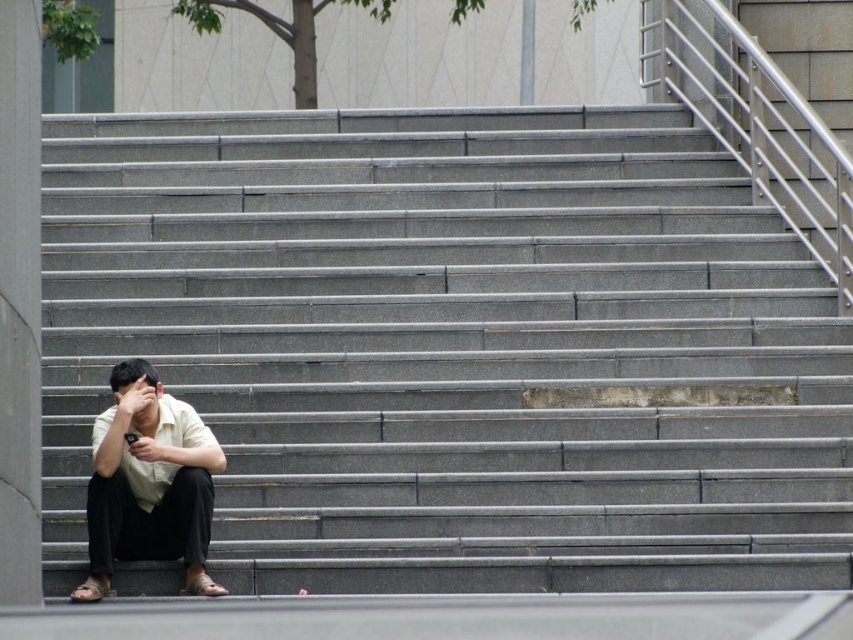
Which of these two, white matte shirt at lower left or white matte hand at lower left, stands taller?

white matte shirt at lower left is taller.

Does white matte shirt at lower left have a greater width compared to white matte hand at lower left?

Yes, white matte shirt at lower left is wider than white matte hand at lower left.

Who is more forward, (106, 589) or (157, 460)?

Point (106, 589)

Identify the location of white matte shirt at lower left. This screenshot has height=640, width=853. (149, 490).

Is gray concrete stairs at lower left positioned in front of matte black hand at lower left?

Yes, it is in front of matte black hand at lower left.

Is gray concrete stairs at lower left further to camera compared to matte black hand at lower left?

No, it is in front of matte black hand at lower left.

Between point (285, 428) and point (119, 392), which one is positioned in front?

Point (119, 392)

I want to click on gray concrete stairs at lower left, so click(x=454, y=348).

Looking at this image, can you confirm if matte black hand at lower left is positioned above white matte hand at lower left?

Yes, matte black hand at lower left is above white matte hand at lower left.

Is point (132, 397) closer to camera compared to point (135, 458)?

No, (132, 397) is further to viewer.

This screenshot has height=640, width=853. Find the location of `matte black hand at lower left`. matte black hand at lower left is located at coordinates (135, 397).